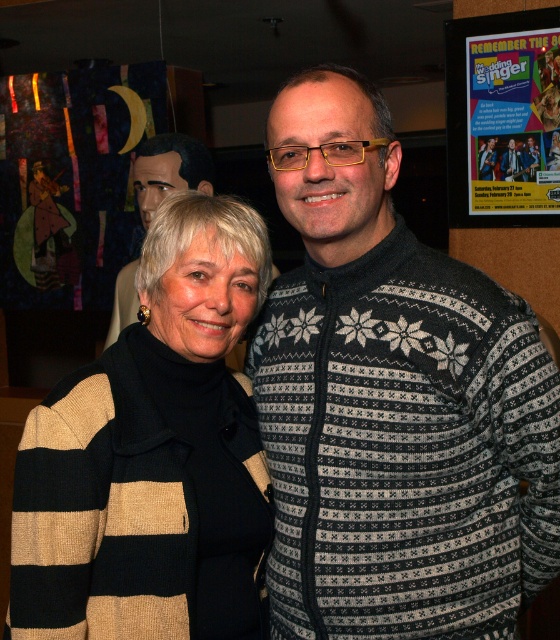
You are a photographer setting up for a group photo. You need to position the striped wool sweater at center and the matte paper poster at upper right so that they are exactly 1.5 meters apart. Are they currently positioned correctly?

The striped wool sweater at center is 1.61 meters from the matte paper poster at upper right, which is 0.11 meters too far apart. They are not positioned correctly for the 1.5 meter requirement.